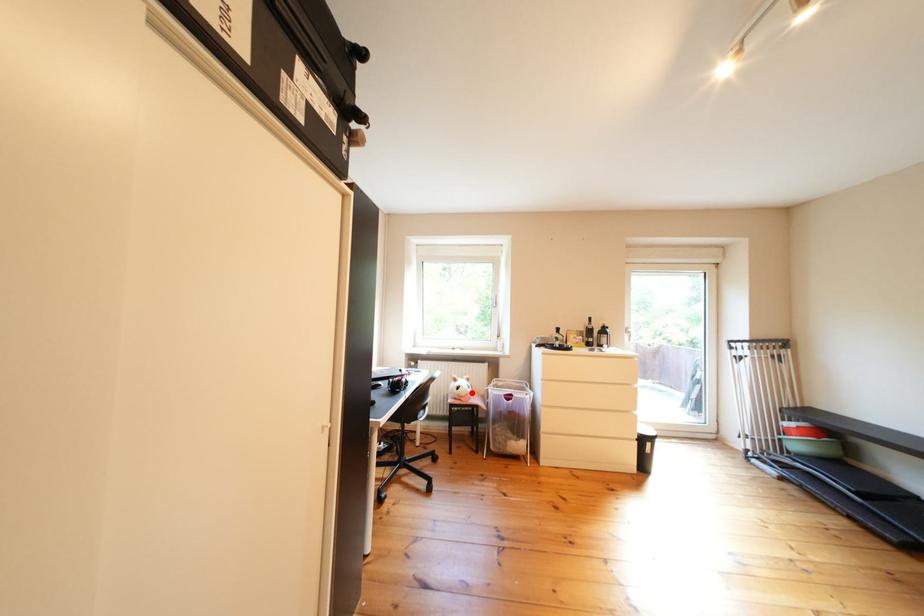
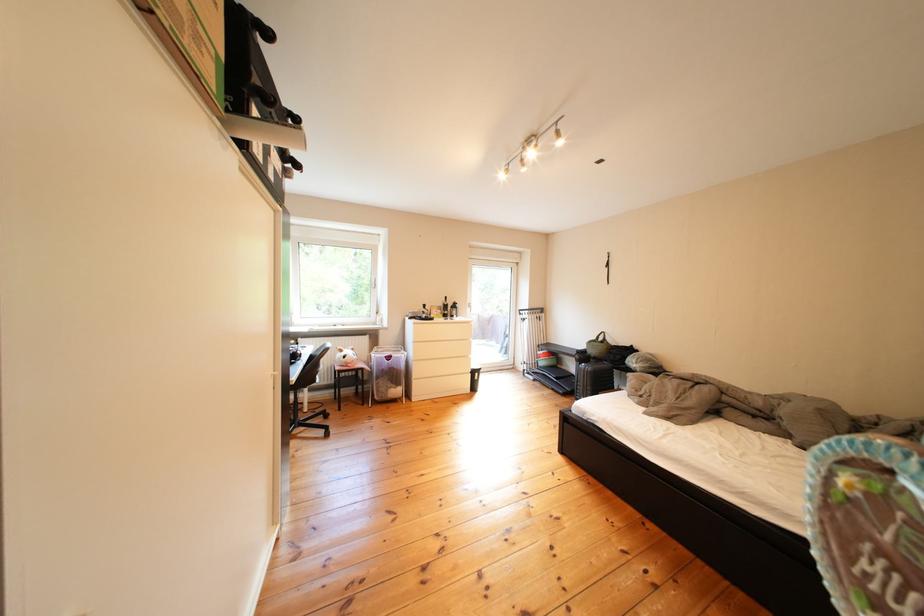
Where in the second image is the point corresponding to the highlighted location from the first image?

(359, 361)